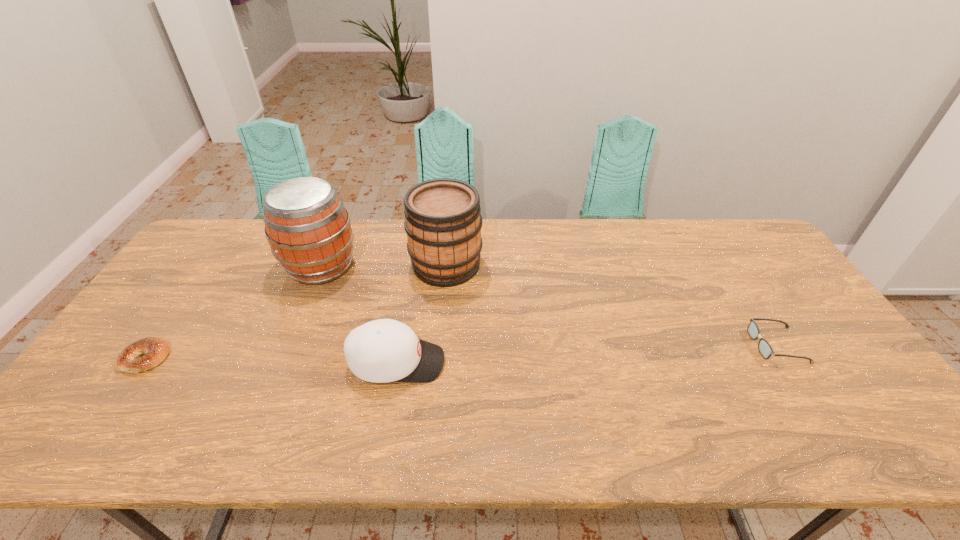
Identify the location of the second object from left to right. (308, 228).

Image resolution: width=960 pixels, height=540 pixels. In order to click on the right cider in this screenshot , I will do `click(443, 222)`.

This screenshot has height=540, width=960. In order to click on baseball cap in this screenshot , I will do `click(385, 350)`.

Locate an element on the screen. This screenshot has width=960, height=540. spectacles is located at coordinates (765, 349).

Locate an element on the screen. Image resolution: width=960 pixels, height=540 pixels. the rightmost object is located at coordinates (765, 349).

I want to click on the shortest object, so click(x=154, y=350).

You are a GUI agent. You are given a task and a screenshot of the screen. Output one action in this format:
    pyautogui.click(x=<x>, y=<y>)
    Task: Click on the leftmost object
    
    Given the screenshot: What is the action you would take?
    pyautogui.click(x=154, y=350)

The image size is (960, 540). What are the coordinates of `free space located on the front of the fourth object from right to left` in the screenshot? It's located at (298, 322).

Locate an element on the screen. Image resolution: width=960 pixels, height=540 pixels. vacant area situated 0.110m on the front of the right cider is located at coordinates (442, 316).

Locate an element on the screen. The image size is (960, 540). vacant space located 0.080m on the front-facing side of the third tallest object is located at coordinates (476, 363).